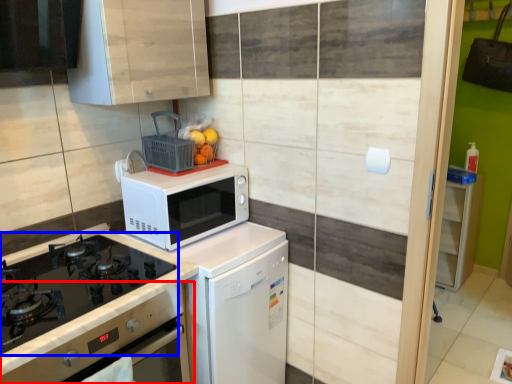
Question: Among these objects, which one is nearest to the camera, oven (highlighted by a red box) or gas stove (highlighted by a blue box)?

Choices:
 (A) oven
 (B) gas stove

Answer: (A)